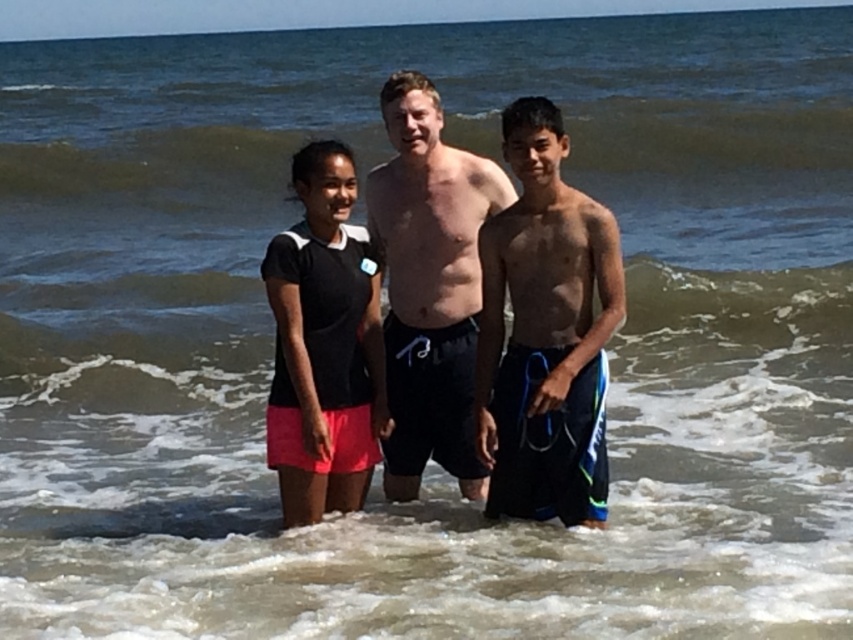
You are a photographer standing at the beach. You want to take a photo of the black matte shorts at center and the black matte skirt at center. The minimum distance required for your camera to focus properly is 18 inches. Based on the scene, will the camera focus correctly on both objects?

The black matte shorts at center is 16.90 inches away from black matte skirt at center. Since the distance between them is less than the minimum focusing distance of 18 inches, the camera may not focus properly on both objects.

You are a photographer trying to capture the perfect shot of the black matte shorts at center and the black matte skirt at center. Since you want to emphasize the width of both items, which one should you zoom in on more to highlight its larger size?

The black matte shorts at center has a larger width than the black matte skirt at center, so zooming in more on the black matte shorts at center would better emphasize its greater width.

You are a photographer standing at the beach and want to take a photo of the blue striped shorts at center and the black matte shorts at center. Which pair of shorts is closer to you?

The blue striped shorts at center is closer to the viewer than the black matte shorts at center.